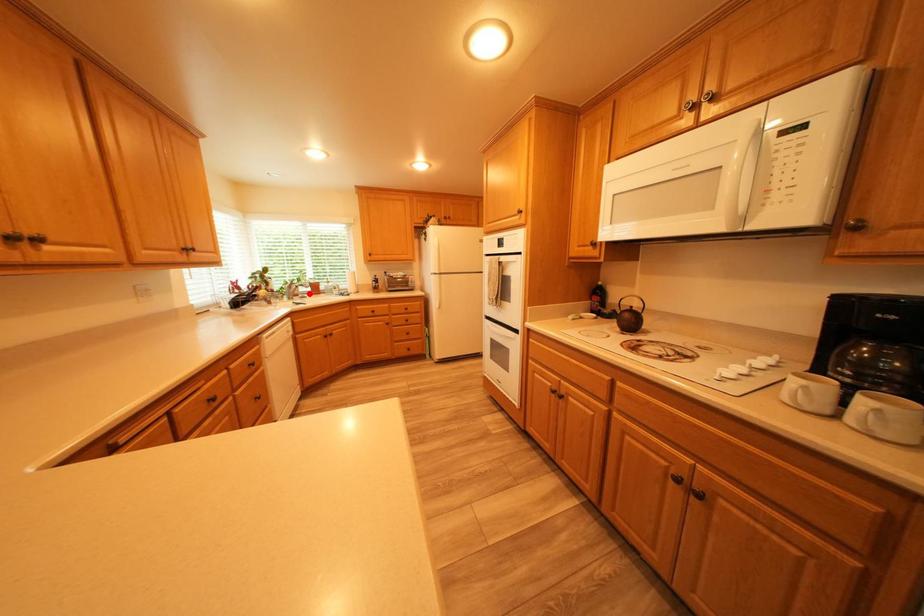
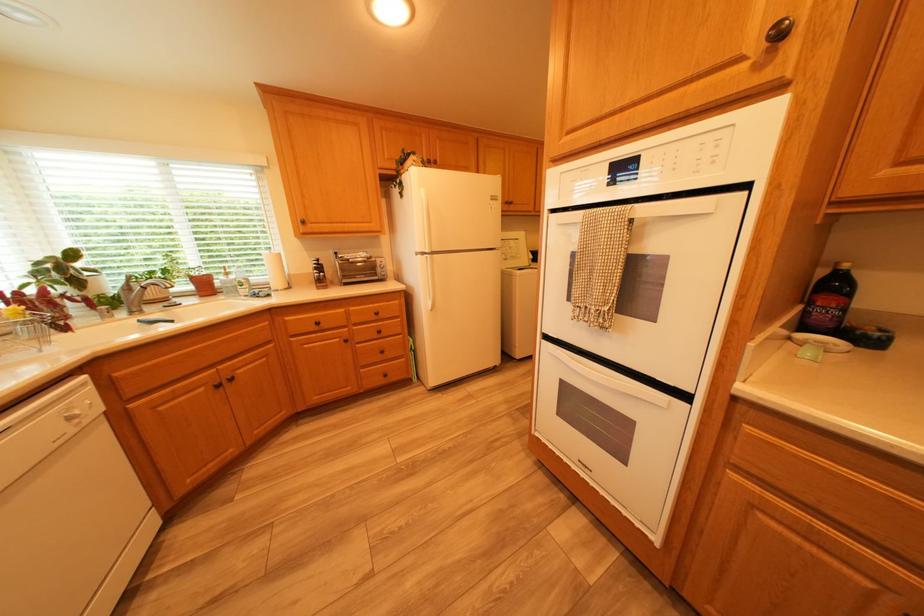
Where in the second image is the point corresponding to the highlighted location from the first image?

(162, 300)